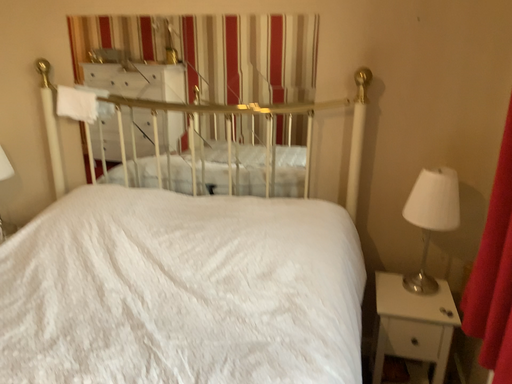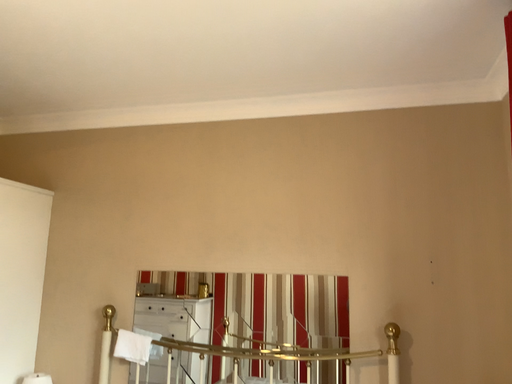
Question: Which way did the camera rotate in the video?

Choices:
 (A) rotated upward
 (B) rotated downward

Answer: (A)